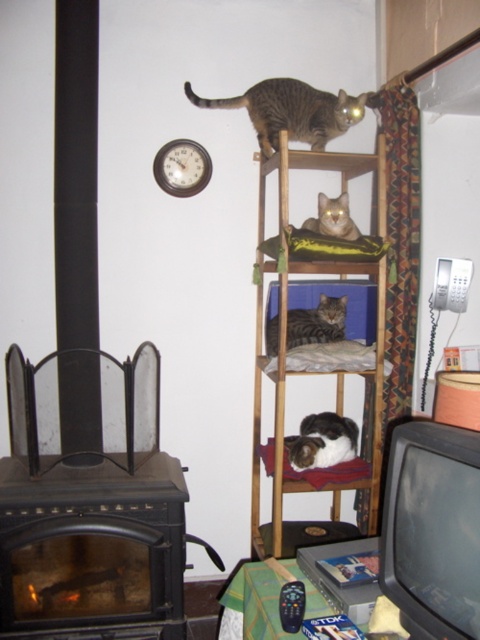
You are standing in front of the multi tiered wooden shelf unit and want to place a small decoration. You have two points marked on the shelf where you can place it. The first point is at point (126, 621) and the second is at point (324, 200). Which point is closer to you so the decoration will be more visible?

Point (126, 621) is closer to the viewer than point (324, 200), so placing the decoration there will make it more visible.

You are designing a living room layout and need to place a new sofa. The sofa is 1.8 meters wide. You have two options for placement. The first option is placing it against the wall where the wooden cat tower at center is currently located. The second option is placing it against the wall where the wooden clock at upper center is. Which wall has enough space for the sofa?

The wooden cat tower at center is bigger than the wooden clock at upper center. Therefore, the wall where the wooden clock at upper center is located has more space available, so placing the sofa there would be better since it can accommodate the 1.8 meter width.

You are a cat owner who wants to place a new cat toy between the wooden cat tower at center and the wooden clock at upper center. The toy requires 18 inches of space. Is there enough space between them?

The wooden cat tower at center is 23.11 inches from the wooden clock at upper center, so yes, there is enough space to place the cat toy between them since 23.11 inches is greater than the required 18 inches.